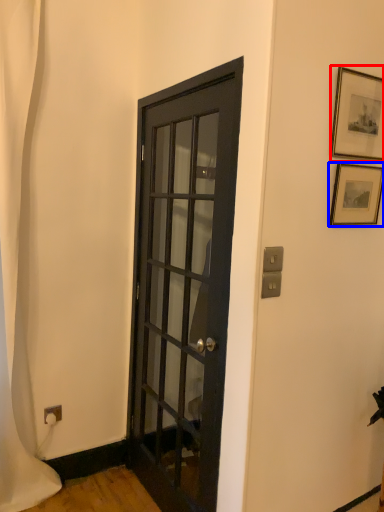
Question: Which object appears closest to the camera in this image, picture frame (highlighted by a red box) or picture frame (highlighted by a blue box)?

Choices:
 (A) picture frame
 (B) picture frame

Answer: (A)